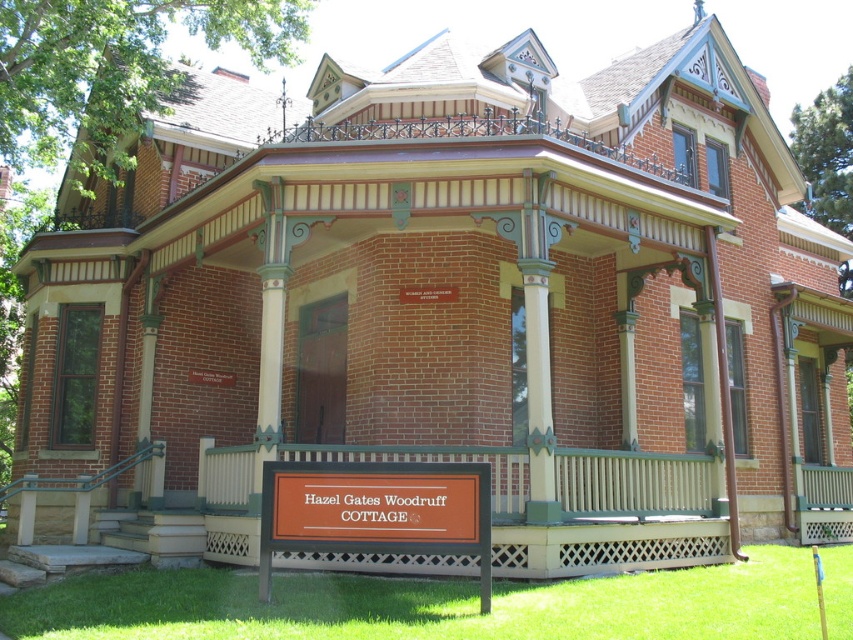
Question: Is wooden porch at lower center smaller than orange matte sign at lower center?

Choices:
 (A) yes
 (B) no

Answer: (B)

Question: Which point is farther from the camera taking this photo?

Choices:
 (A) (527, 544)
 (B) (364, 490)

Answer: (A)

Question: Considering the relative positions of wooden porch at lower center and orange matte sign at lower center in the image provided, where is wooden porch at lower center located with respect to orange matte sign at lower center?

Choices:
 (A) left
 (B) right

Answer: (B)

Question: Which object appears farthest from the camera in this image?

Choices:
 (A) orange matte sign at lower center
 (B) wooden porch at lower center

Answer: (B)

Question: Does wooden porch at lower center appear on the right side of orange matte sign at lower center?

Choices:
 (A) no
 (B) yes

Answer: (B)